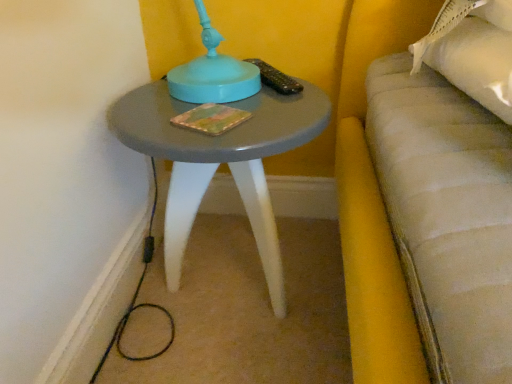
Image resolution: width=512 pixels, height=384 pixels. Identify the location of vacant area that is in front of multicolored textured book at center. (212, 134).